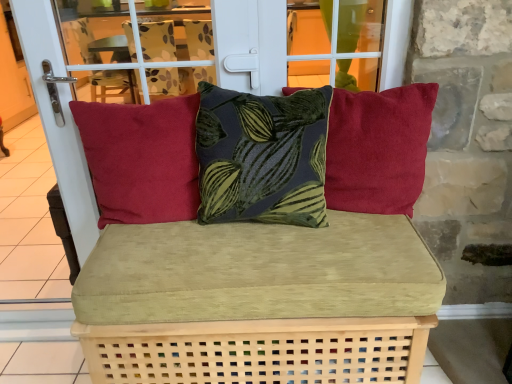
Identify the location of free space above velvet green cushion at center (from a real-world perspective). This screenshot has height=384, width=512. (239, 242).